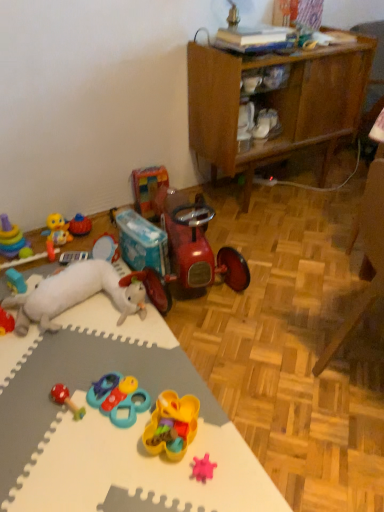
This screenshot has width=384, height=512. What are the coordinates of `vacant space that is in between wooden cabinet at upper right and shiny red tricycle at center, which appears as the 10th toy when viewed from the left` in the screenshot? It's located at (274, 239).